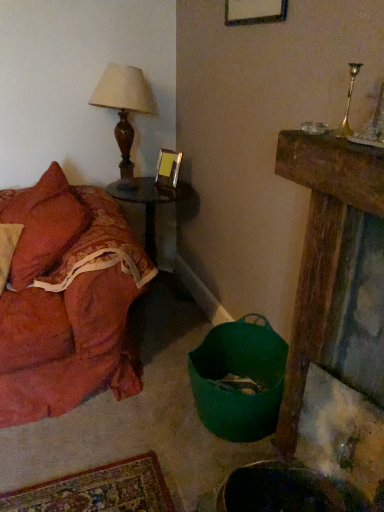
This screenshot has width=384, height=512. What do you see at coordinates (168, 168) in the screenshot?
I see `metallic gold picture frame at upper center` at bounding box center [168, 168].

This screenshot has width=384, height=512. Identify the location of velvet orange couch at left. (67, 300).

In order to face velvet orange couch at left, should I rotate leftwards or rightwards?

Turn left by 16.563 degrees to look at velvet orange couch at left.

At what (x,y) coordinates should I click in order to perform the action: click on wooden side table at center. Please return your answer as a coordinate pair (x, y). The height and width of the screenshot is (512, 384). Looking at the image, I should click on (151, 203).

Between matte brown wood table lamp at upper left and wooden side table at center, which one has smaller size?

With smaller size is matte brown wood table lamp at upper left.

Is there a large distance between matte brown wood table lamp at upper left and wooden side table at center?

Actually, matte brown wood table lamp at upper left and wooden side table at center are a little close together.

I want to click on table below the matte brown wood table lamp at upper left (from a real-world perspective), so click(151, 203).

From the image's perspective, does matte brown wood table lamp at upper left appear lower than wooden side table at center?

No, from the image's perspective, matte brown wood table lamp at upper left is not below wooden side table at center.

Is wooden side table at center to the left of matte brown wood table lamp at upper left from the viewer's perspective?

No.

Consider the image. How much distance is there between wooden side table at center and matte brown wood table lamp at upper left?

They are 19.06 inches apart.

From the image's perspective, is wooden side table at center under matte brown wood table lamp at upper left?

Indeed, from the image's perspective, wooden side table at center is shown beneath matte brown wood table lamp at upper left.

Is the surface of wooden side table at center in direct contact with matte brown wood table lamp at upper left?

wooden side table at center is not next to matte brown wood table lamp at upper left, and they're not touching.

Is wooden side table at center facing away from velvet orange couch at left?

No, wooden side table at center is not facing the opposite direction of velvet orange couch at left.

From the picture: Can you confirm if wooden side table at center is positioned to the left of velvet orange couch at left?

In fact, wooden side table at center is to the right of velvet orange couch at left.

From their relative heights in the image, would you say wooden side table at center is taller or shorter than velvet orange couch at left?

Clearly, wooden side table at center is shorter compared to velvet orange couch at left.

Based on the photo, how far apart are wooden side table at center and velvet orange couch at left?

wooden side table at center and velvet orange couch at left are 23.63 inches apart from each other.

From the image's perspective, between metallic gold picture frame at upper center and wooden side table at center, which one is located above?

metallic gold picture frame at upper center.

Between point (161, 154) and point (145, 249), which one is positioned behind?

The point (145, 249) is farther.

Is metallic gold picture frame at upper center with wooden side table at center?

metallic gold picture frame at upper center is not next to wooden side table at center, and they're not touching.

Based on their sizes in the image, would you say matte brown wood table lamp at upper left is bigger or smaller than velvet orange couch at left?

In the image, matte brown wood table lamp at upper left appears to be smaller than velvet orange couch at left.

Does point (120, 182) come in front of point (84, 261)?

No, it is not.

Where is `studio couch located underneath the matte brown wood table lamp at upper left (from a real-world perspective)`? The width and height of the screenshot is (384, 512). studio couch located underneath the matte brown wood table lamp at upper left (from a real-world perspective) is located at coordinates (67, 300).

Is matte brown wood table lamp at upper left not near metallic gold picture frame at upper center?

No, matte brown wood table lamp at upper left is not far from metallic gold picture frame at upper center.

Considering their positions, is matte brown wood table lamp at upper left located in front of or behind metallic gold picture frame at upper center?

matte brown wood table lamp at upper left is positioned closer to the viewer than metallic gold picture frame at upper center.

Would you say matte brown wood table lamp at upper left is outside metallic gold picture frame at upper center?

Yes.

Is matte brown wood table lamp at upper left positioned with its back to metallic gold picture frame at upper center?

No, matte brown wood table lamp at upper left is not facing away from metallic gold picture frame at upper center.

Is matte brown wood table lamp at upper left completely or partially inside velvet orange couch at left?

No, matte brown wood table lamp at upper left is not inside velvet orange couch at left.

Considering the relative positions of velvet orange couch at left and matte brown wood table lamp at upper left in the image provided, is velvet orange couch at left in front of matte brown wood table lamp at upper left?

Yes, it is in front of matte brown wood table lamp at upper left.

Considering the relative sizes of velvet orange couch at left and matte brown wood table lamp at upper left in the image provided, is velvet orange couch at left smaller than matte brown wood table lamp at upper left?

Incorrect, velvet orange couch at left is not smaller in size than matte brown wood table lamp at upper left.

Does velvet orange couch at left touch matte brown wood table lamp at upper left?

No, velvet orange couch at left is not making contact with matte brown wood table lamp at upper left.

The image size is (384, 512). Identify the location of table lamp that appears on the left of wooden side table at center. (124, 111).

You are a GUI agent. You are given a task and a screenshot of the screen. Output one action in this format:
    pyautogui.click(x=<x>, y=<y>)
    Task: Click on the table that appears on the right of matte brown wood table lamp at upper left
    This screenshot has width=384, height=512.
    Given the screenshot: What is the action you would take?
    pyautogui.click(x=151, y=203)

When comparing their distances from matte brown wood table lamp at upper left, does velvet orange couch at left or wooden side table at center seem further?

velvet orange couch at left lies further to matte brown wood table lamp at upper left than the other object.

When comparing their distances from velvet orange couch at left, does metallic gold picture frame at upper center or wooden side table at center seem closer?

wooden side table at center lies closer to velvet orange couch at left than the other object.

Considering their positions, is matte brown wood table lamp at upper left positioned closer to velvet orange couch at left than wooden side table at center?

wooden side table at center is closer to velvet orange couch at left.

Estimate the real-world distances between objects in this image. Which object is closer to matte brown wood table lamp at upper left, wooden side table at center or metallic gold picture frame at upper center?

metallic gold picture frame at upper center lies closer to matte brown wood table lamp at upper left than the other object.

Which object lies nearer to the anchor point wooden side table at center, metallic gold picture frame at upper center or matte brown wood table lamp at upper left?

Among the two, metallic gold picture frame at upper center is located nearer to wooden side table at center.

From the image, which object appears to be farther from wooden side table at center, velvet orange couch at left or matte brown wood table lamp at upper left?

velvet orange couch at left is positioned further to the anchor wooden side table at center.

Looking at the image, which one is located closer to matte brown wood table lamp at upper left, metallic gold picture frame at upper center or velvet orange couch at left?

Among the two, metallic gold picture frame at upper center is located nearer to matte brown wood table lamp at upper left.

Estimate the real-world distances between objects in this image. Which object is closer to velvet orange couch at left, wooden side table at center or matte brown wood table lamp at upper left?

wooden side table at center.

The image size is (384, 512). Find the location of `table lamp located between velvet orange couch at left and metallic gold picture frame at upper center in the depth direction`. table lamp located between velvet orange couch at left and metallic gold picture frame at upper center in the depth direction is located at coordinates (124, 111).

Identify the location of picture frame between matte brown wood table lamp at upper left and wooden side table at center from top to bottom. The image size is (384, 512). (168, 168).

Locate an element on the screen. Image resolution: width=384 pixels, height=512 pixels. table lamp between velvet orange couch at left and wooden side table at center along the z-axis is located at coordinates (124, 111).

Find the location of `table between velvet orange couch at left and metallic gold picture frame at upper center along the z-axis`. table between velvet orange couch at left and metallic gold picture frame at upper center along the z-axis is located at coordinates (151, 203).